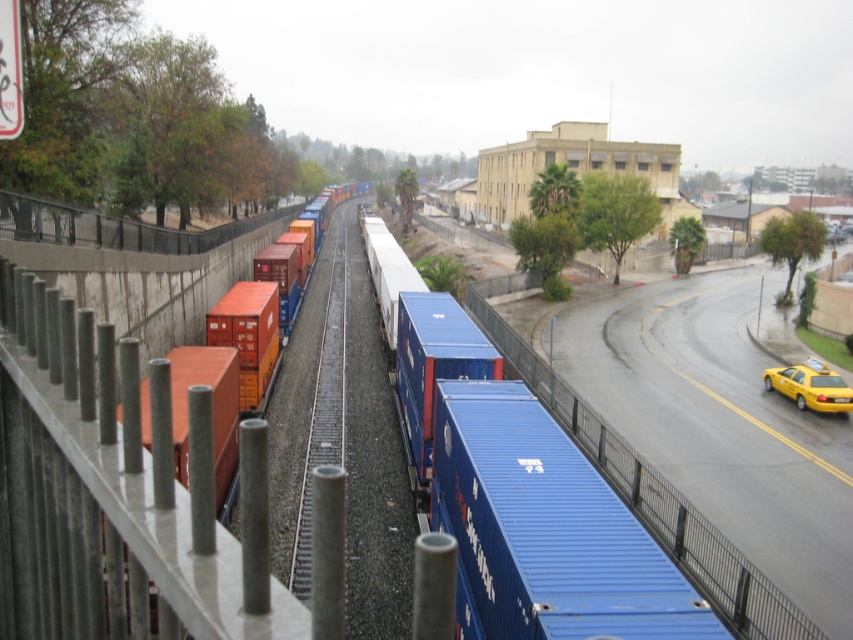
You are a delivery person trying to decide whether to place a large package on the blue metal train track at center or the orange matte container at center. Based on their sizes, which location would be more suitable for the package?

The orange matte container at center is larger than the blue metal train track at center, so placing the large package on the orange matte container at center would be more suitable.